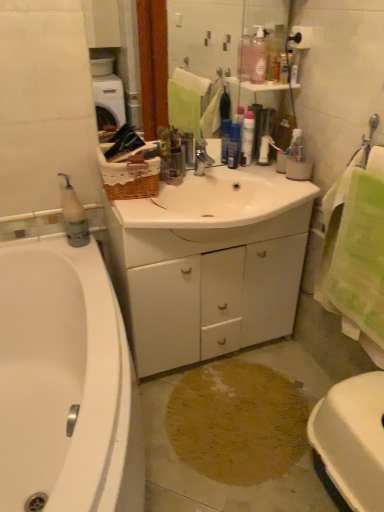
You are a GUI agent. You are given a task and a screenshot of the screen. Output one action in this format:
    pyautogui.click(x=<x>, y=<y>)
    Task: Click on the vacant area that lies in front of white plastic bottle at left, which ranks as the first cleaning product in bottom-to-top order
    
    Given the screenshot: What is the action you would take?
    pyautogui.click(x=74, y=251)